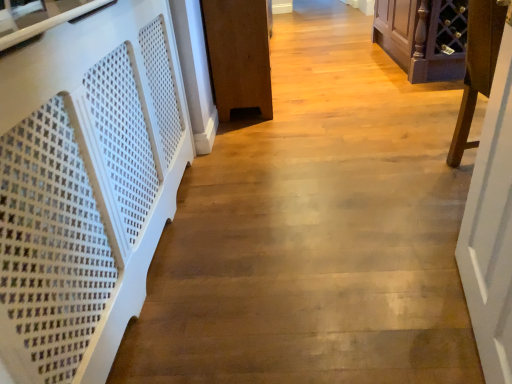
Question: Relative to dark wood wine rack at upper right, the 1th furniture in the right-to-left sequence, is brown wood cabinet at center, the 3th furniture viewed from the right, in front or behind?

Choices:
 (A) behind
 (B) front

Answer: (B)

Question: Considering the positions of brown wood cabinet at center, which is the 1th furniture from left to right, and dark wood wine rack at upper right, the third furniture positioned from the left, in the image, is brown wood cabinet at center, which is the 1th furniture from left to right, taller or shorter than dark wood wine rack at upper right, the third furniture positioned from the left,?

Choices:
 (A) short
 (B) tall

Answer: (B)

Question: Which is nearer to the purple wood wine rack at right, marked as the 2th furniture in a right-to-left arrangement?

Choices:
 (A) white perforated wood at left
 (B) white perforated panel at left
 (C) dark wood wine rack at upper right, the third furniture positioned from the left
 (D) brown wood cabinet at center, which is the 1th furniture from left to right
 (E) white wooden door at right

Answer: (E)

Question: Which object is positioned closest to the white wooden door at right?

Choices:
 (A) dark wood wine rack at upper right, the 1th furniture in the right-to-left sequence
 (B) white perforated wood at left
 (C) white perforated panel at left
 (D) brown wood cabinet at center, which is the 1th furniture from left to right
 (E) purple wood wine rack at right, which appears as the 2th furniture when viewed from the left

Answer: (E)